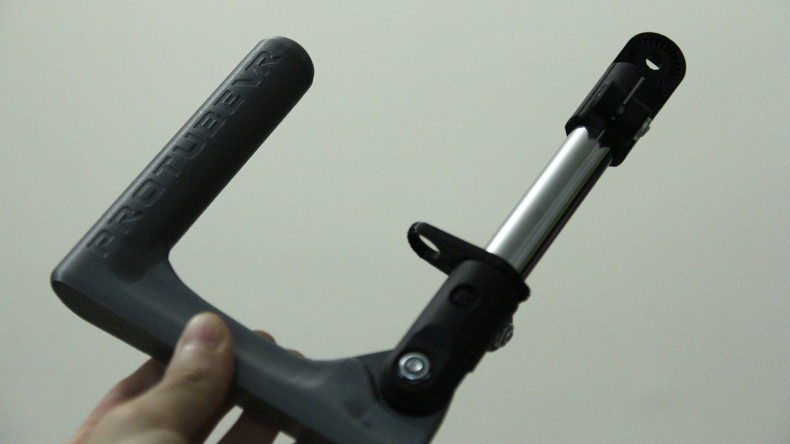
At what (x,y) coordinates should I click in order to perform the action: click on handle. Please return your answer as a coordinate pair (x, y). The image size is (790, 444). Looking at the image, I should click on (152, 280).